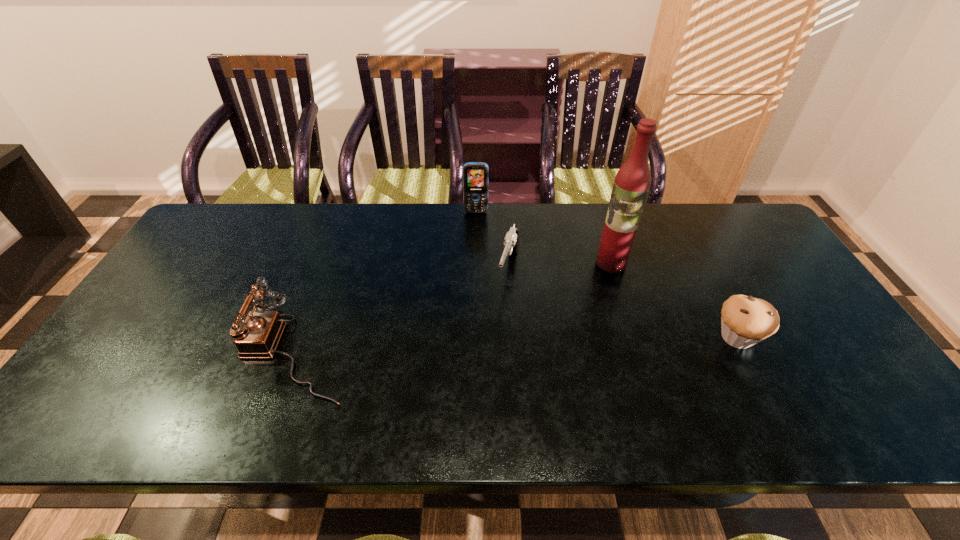
At what (x,y) coordinates should I click in order to perform the action: click on vacant position located on the left of the rightmost object. Please return your answer as a coordinate pair (x, y). Image resolution: width=960 pixels, height=540 pixels. Looking at the image, I should click on (630, 338).

Image resolution: width=960 pixels, height=540 pixels. In order to click on vacant space located on the label of the liquor in this screenshot , I will do `click(579, 312)`.

Locate an element on the screen. free spot located on the label of the liquor is located at coordinates (551, 355).

Find the location of a particular element. The height and width of the screenshot is (540, 960). vacant region located 0.160m on the label of the liquor is located at coordinates (584, 305).

Find the location of a particular element. The width and height of the screenshot is (960, 540). free region located on the screen of the fourth object from right to left is located at coordinates (475, 285).

Find the location of a particular element. vacant space located 0.320m on the screen of the fourth object from right to left is located at coordinates (475, 280).

I want to click on blank space located on the screen of the fourth object from right to left, so click(475, 298).

Locate an element on the screen. The height and width of the screenshot is (540, 960). free region located 0.280m at the muzzle of the third object from right to left is located at coordinates (486, 380).

The height and width of the screenshot is (540, 960). What are the coordinates of `free space located 0.070m at the muzzle of the third object from right to left` in the screenshot? It's located at point(503,314).

You are a GUI agent. You are given a task and a screenshot of the screen. Output one action in this format:
    pyautogui.click(x=<x>, y=<y>)
    Task: Click on the vacant space situated at the muzzle of the third object from right to left
    
    Given the screenshot: What is the action you would take?
    pyautogui.click(x=492, y=360)